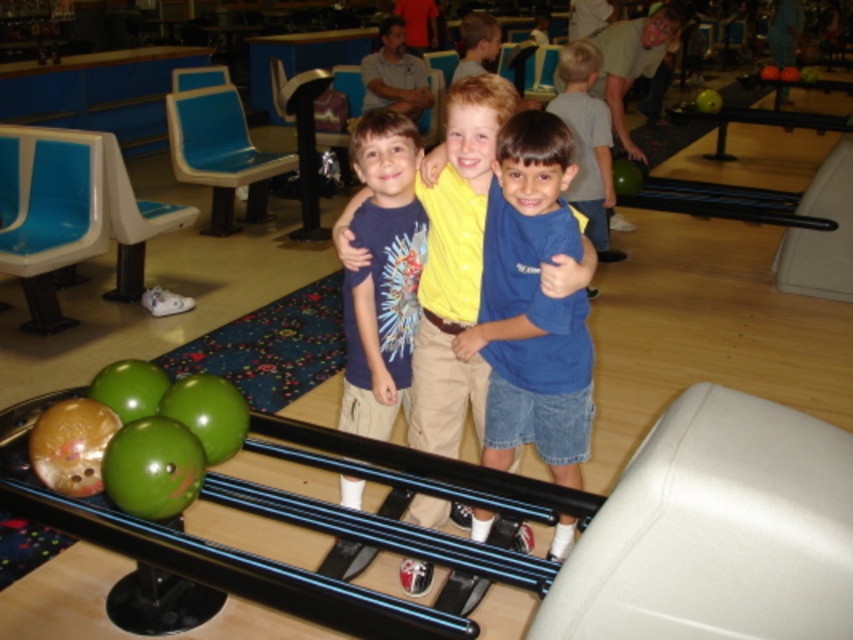
You are a photographer taking a picture of the blue denim shorts at center and the blue cotton shirt at center. Which one should you adjust to ensure they are aligned properly in the frame?

The blue denim shorts at center is to the right of the blue cotton shirt at center, so you should move the blue denim shorts at center to the left or the blue cotton shirt at center to the right to align them properly.

You are standing in the bowling alley and want to move from the point at coordinates point (509, 413) to the point at coordinates point (415, 147). Which direction should you move in to get closer to the latter?

To move from point (509, 413) to point (415, 147), you should move towards the left and slightly downward since point (415, 147) is closer to the viewer compared to point (509, 413).

You are a photographer trying to capture a photo of the blue denim shorts at center and the blue cotton shirt at center. Which object should you focus on first if you want to ensure both are in focus without adjusting your camera settings?

The blue denim shorts at center is shorter than the blue cotton shirt at center, so you should focus on the blue cotton shirt at center first to ensure both are in focus.